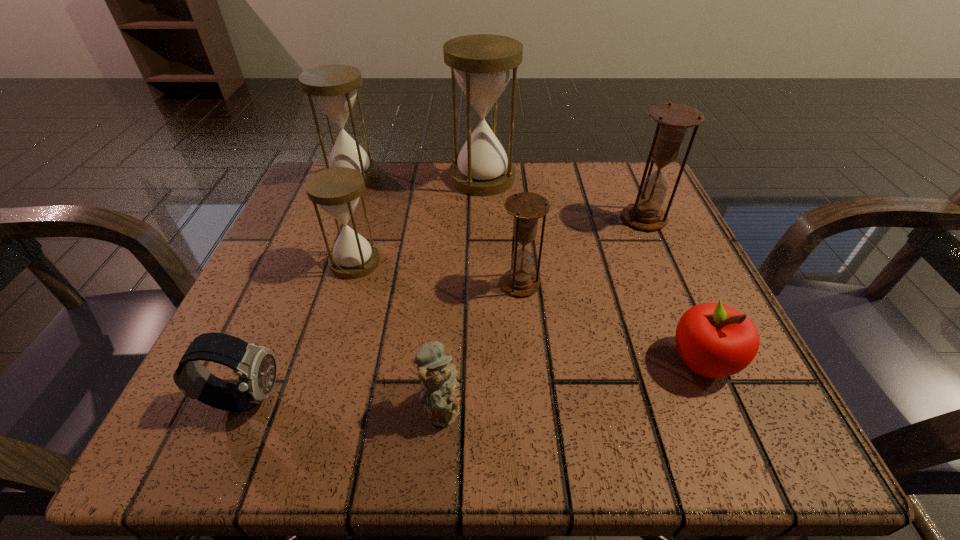
This screenshot has height=540, width=960. Identify the location of apple that is at the near edge. (714, 340).

Find the location of a particular element. This screenshot has width=960, height=540. watch that is at the near edge is located at coordinates (256, 367).

Where is `watch positioned at the left edge`? This screenshot has height=540, width=960. watch positioned at the left edge is located at coordinates [x=256, y=367].

What are the coordinates of `hourglass that is at the right edge` in the screenshot? It's located at (673, 120).

I want to click on apple that is at the right edge, so click(714, 340).

Where is `object at the far left corner`? The image size is (960, 540). object at the far left corner is located at coordinates (334, 88).

Locate an element on the screen. object located at the near left corner is located at coordinates (256, 367).

Find the location of a particular element. The width and height of the screenshot is (960, 540). object positioned at the far right corner is located at coordinates (673, 120).

The width and height of the screenshot is (960, 540). Identify the location of object at the near right corner. (714, 340).

You are a GUI agent. You are given a task and a screenshot of the screen. Output one action in this format:
    pyautogui.click(x=<x>, y=<y>)
    Task: Click on the free space at the far edge
    
    Given the screenshot: What is the action you would take?
    pyautogui.click(x=548, y=177)